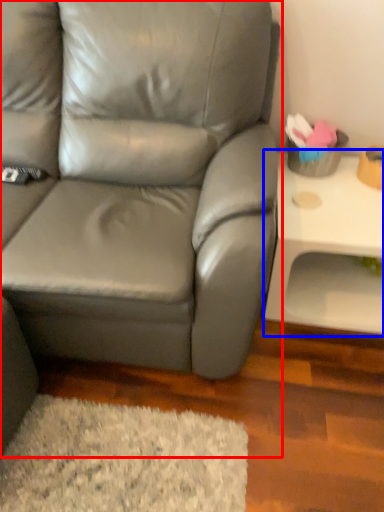
Question: Which object appears closest to the camera in this image, studio couch (highlighted by a red box) or table (highlighted by a blue box)?

Choices:
 (A) studio couch
 (B) table

Answer: (A)